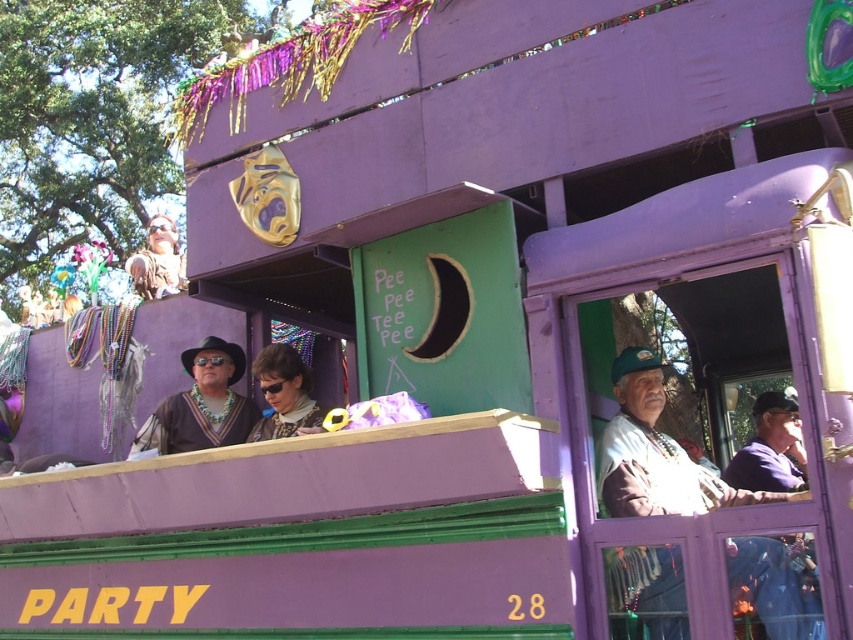
You are a photographer standing in front of the purple float at the parade. You want to take a photo that includes both point (627,474) and point (316,429). Which point should you focus on first to ensure both are in clear view?

You should focus on point (627,474) first because it is closer to the camera than point (316,429). This ensures that both points will be in focus as the camera adjusts for the closer object.

You are standing 30 feet away from the float and want to take a photo of the matte black sunglasses at center. Is the sunglasses within your camera lens range if the camera can focus up to 30 feet?

The matte black sunglasses at center is 29.05 feet away from the camera, which is within the camera lens range of 30 feet. Therefore, the sunglasses can be focused on.